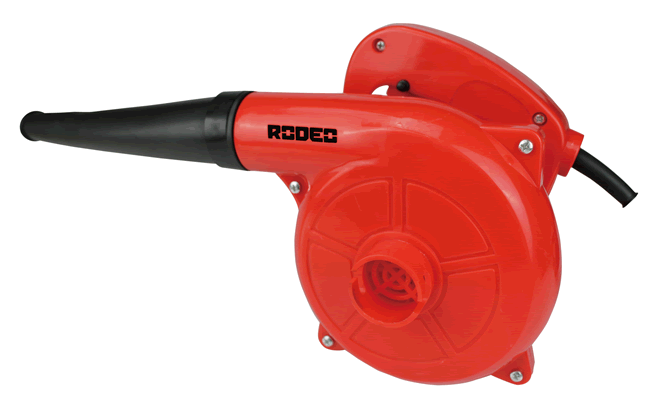
Where is `screws`? This screenshot has height=398, width=650. screws is located at coordinates (292, 181), (327, 342), (520, 376).